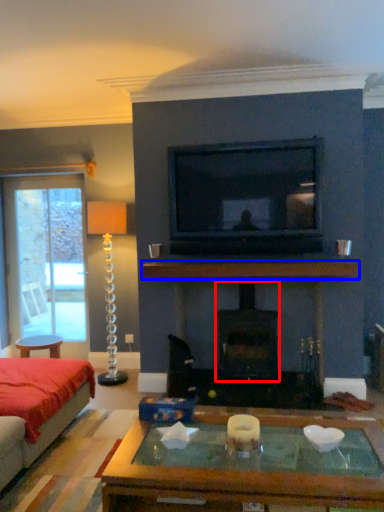
Question: Which point is further to the camera, fireplace (highlighted by a red box) or mantle (highlighted by a blue box)?

Choices:
 (A) fireplace
 (B) mantle

Answer: (A)